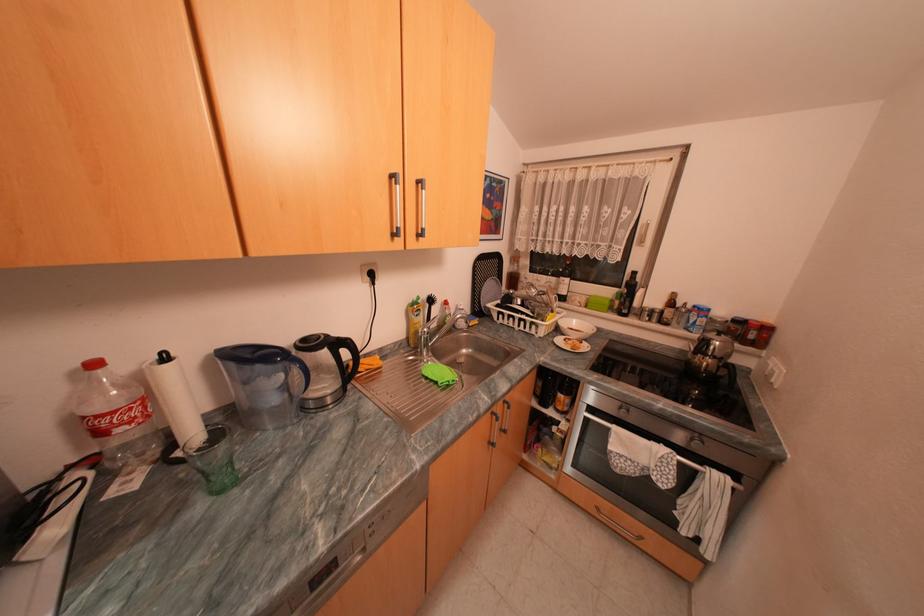
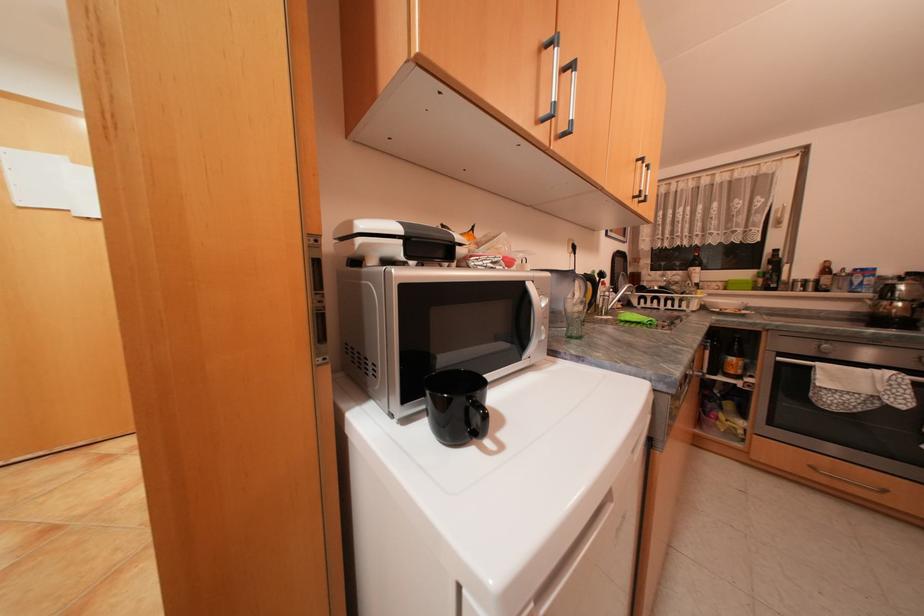
Find the pixel in the second image that matches point 624,427 in the first image.

(830, 363)